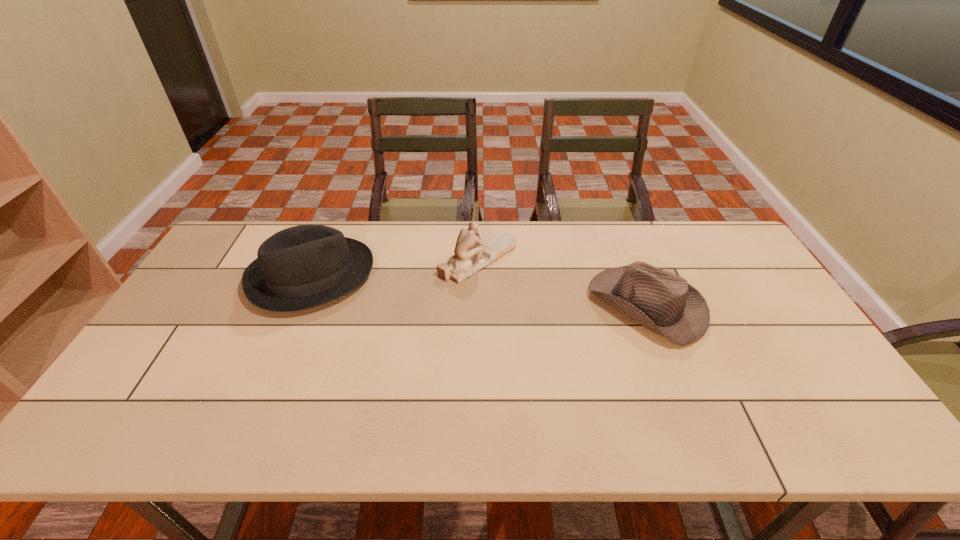
Where is `vacant area between the second object from left to right and the taller fedora`? Image resolution: width=960 pixels, height=540 pixels. vacant area between the second object from left to right and the taller fedora is located at coordinates (395, 268).

Find the location of `empty space that is in between the right fedora and the leftmost object`. empty space that is in between the right fedora and the leftmost object is located at coordinates (479, 291).

You are a GUI agent. You are given a task and a screenshot of the screen. Output one action in this format:
    pyautogui.click(x=<x>, y=<y>)
    Task: Click on the empty space between the shorter fedora and the taller fedora
    The height and width of the screenshot is (540, 960).
    Given the screenshot: What is the action you would take?
    pyautogui.click(x=479, y=291)

Find the location of `empty space between the figurine and the leftmost object`. empty space between the figurine and the leftmost object is located at coordinates (395, 268).

At what (x,y) coordinates should I click in order to perform the action: click on unoccupied position between the figurine and the rightmost object. Please return your answer as a coordinate pair (x, y). This screenshot has height=540, width=960. Looking at the image, I should click on (563, 282).

Locate an element on the screen. vacant area that lies between the figurine and the right fedora is located at coordinates (563, 282).

Where is `unoccupied position between the leftmost object and the second object from left to right`? unoccupied position between the leftmost object and the second object from left to right is located at coordinates (395, 268).

At what (x,y) coordinates should I click in order to perform the action: click on free space between the shortest object and the figurine. Please return your answer as a coordinate pair (x, y). Looking at the image, I should click on (563, 282).

Where is `free point between the left fedora and the figurine`? free point between the left fedora and the figurine is located at coordinates (395, 268).

Locate an element on the screen. The width and height of the screenshot is (960, 540). the closest object relative to the leftmost object is located at coordinates pos(472,254).